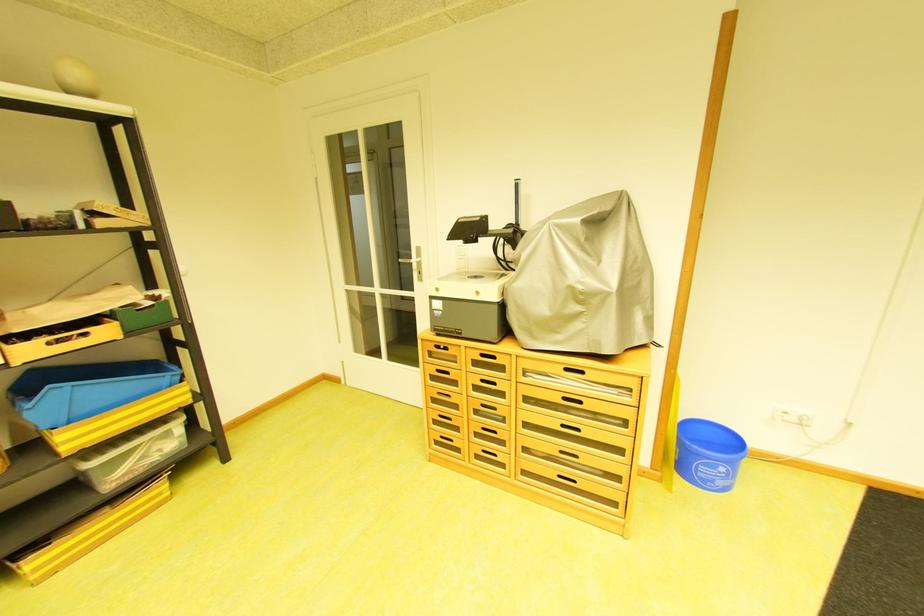
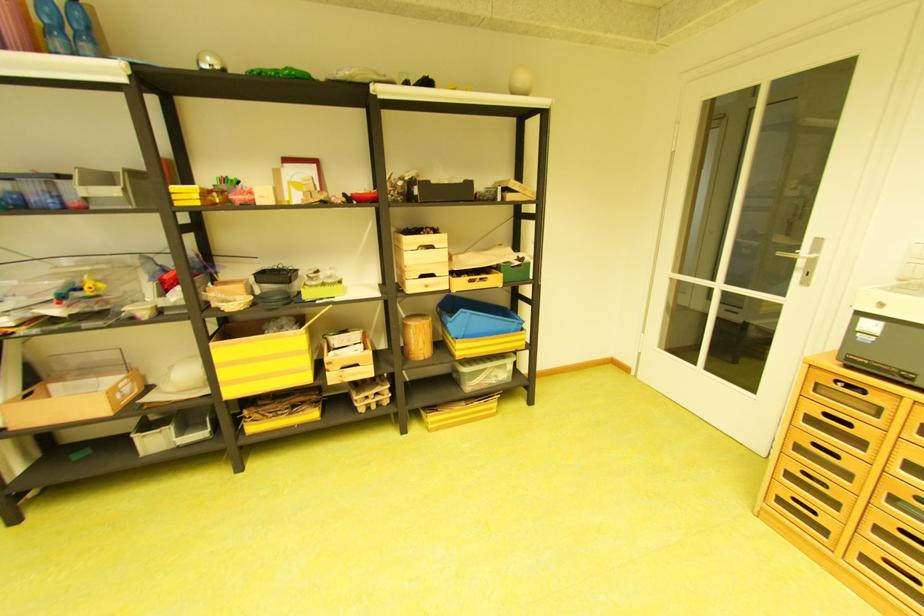
Question: The first image is from the beginning of the video and the second image is from the end. How did the camera likely rotate when shooting the video?

Choices:
 (A) Left
 (B) Right
 (C) Up
 (D) Down

Answer: (A)